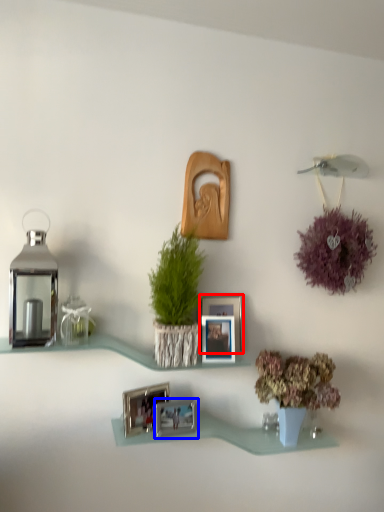
Question: Among these objects, which one is farthest to the camera, picture frame (highlighted by a red box) or picture frame (highlighted by a blue box)?

Choices:
 (A) picture frame
 (B) picture frame

Answer: (A)